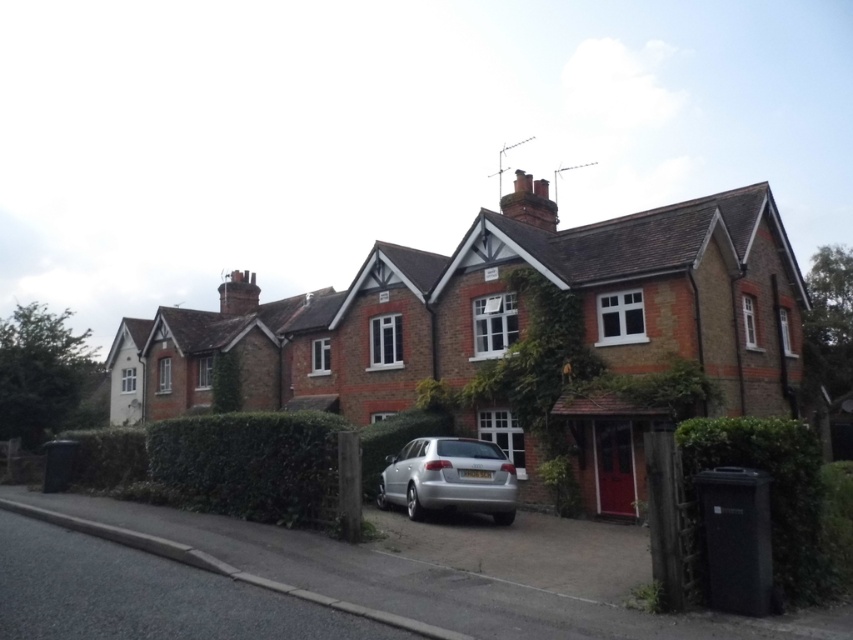
Question: Does green leafy hedge at lower left have a lesser width compared to silver metallic car at center?

Choices:
 (A) no
 (B) yes

Answer: (B)

Question: Does green leafy hedge at lower right appear under silver metallic car at center?

Choices:
 (A) yes
 (B) no

Answer: (B)

Question: From the image, what is the correct spatial relationship of green leafy hedge at lower right in relation to silver metallic car at center?

Choices:
 (A) left
 (B) right

Answer: (B)

Question: Among these points, which one is nearest to the camera?

Choices:
 (A) (267, 417)
 (B) (453, 497)

Answer: (A)

Question: Which object is the farthest from the silver metallic car at center?

Choices:
 (A) green leafy hedge at lower right
 (B) green leafy hedge at lower left

Answer: (A)

Question: Which of the following is the closest to the observer?

Choices:
 (A) silver metallic car at center
 (B) green leafy hedge at lower right

Answer: (B)